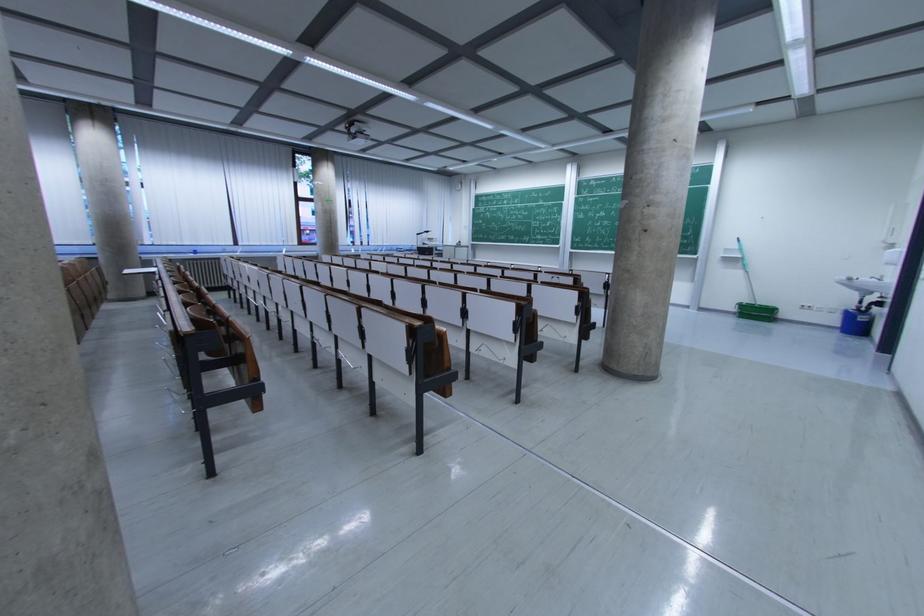
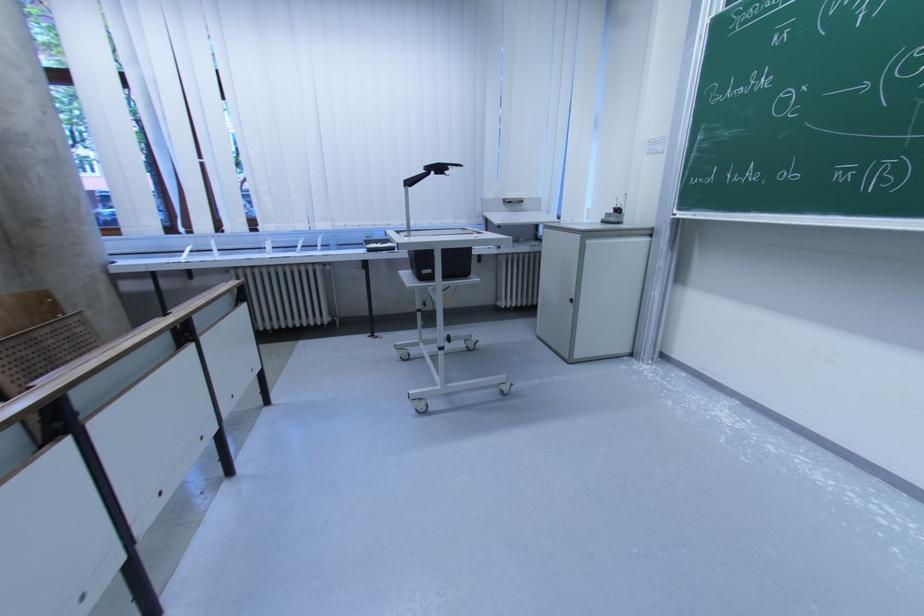
Find the pixel in the second image that matches (432,233) in the first image.

(444, 171)